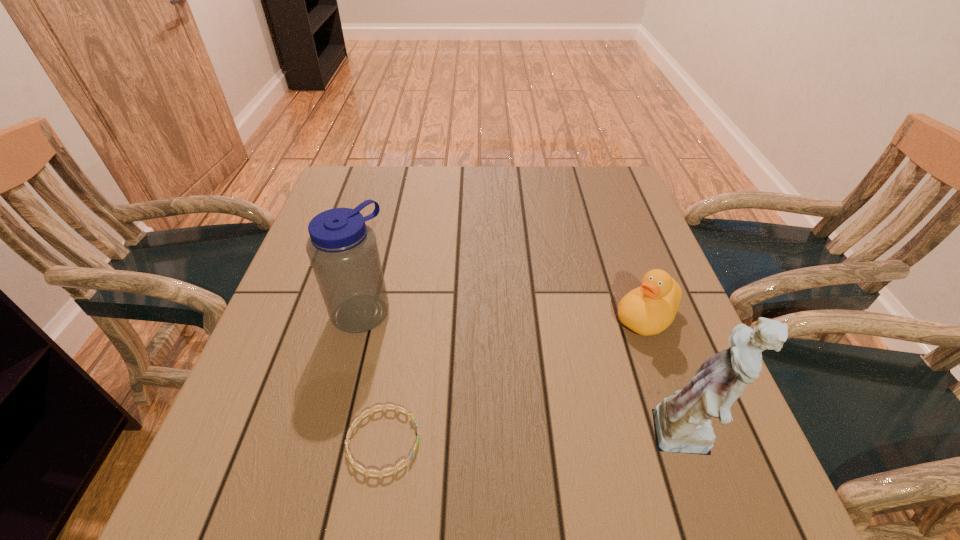
Locate an element on the screen. vacant space on the desktop that is between the shortest object and the figurine and is positioned with a carrying loop on the side of the water bottle is located at coordinates (504, 440).

This screenshot has height=540, width=960. I want to click on free space on the desktop that is between the shortest object and the figurine and is positioned on the face of the duck, so click(x=515, y=440).